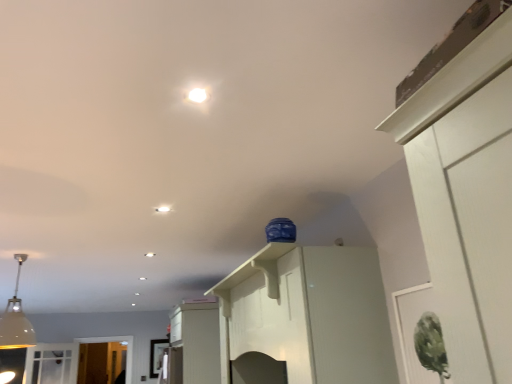
Question: From a real-world perspective, is white glossy cabinet at upper center, which ranks as the 2th cabinetry in bottom-to-top order, located higher than white glossy light fixture at center?

Choices:
 (A) no
 (B) yes

Answer: (A)

Question: Is white glossy cabinet at upper center, which appears as the 1th cabinetry when viewed from the front, to the right of white glossy light fixture at center from the viewer's perspective?

Choices:
 (A) yes
 (B) no

Answer: (A)

Question: Considering the relative sizes of white glossy cabinet at upper center, which is counted as the 1th cabinetry, starting from the top, and white glossy light fixture at center in the image provided, is white glossy cabinet at upper center, which is counted as the 1th cabinetry, starting from the top, taller than white glossy light fixture at center?

Choices:
 (A) no
 (B) yes

Answer: (B)

Question: Is white glossy cabinet at upper center, marked as the 2th cabinetry in a left-to-right arrangement, thinner than white glossy light fixture at center?

Choices:
 (A) yes
 (B) no

Answer: (B)

Question: Is white glossy cabinet at upper center, marked as the 2th cabinetry in a left-to-right arrangement, far away from white glossy light fixture at center?

Choices:
 (A) no
 (B) yes

Answer: (A)

Question: Would you say white glossy cabinet at upper center, the first cabinetry viewed from the right, is outside white glossy light fixture at center?

Choices:
 (A) yes
 (B) no

Answer: (A)

Question: Does white glossy light fixture at center have a larger size compared to white glossy cabinet at upper center, marked as the 2th cabinetry in a left-to-right arrangement?

Choices:
 (A) no
 (B) yes

Answer: (A)

Question: Does white glossy light fixture at center appear on the right side of white glossy cabinet at upper center, which appears as the 1th cabinetry when viewed from the front?

Choices:
 (A) no
 (B) yes

Answer: (A)

Question: From the image's perspective, does white glossy light fixture at center appear lower than white glossy cabinet at upper center, which is counted as the 1th cabinetry, starting from the top?

Choices:
 (A) no
 (B) yes

Answer: (A)

Question: Considering the relative sizes of white glossy light fixture at center and white glossy cabinet at upper center, which ranks as the 2th cabinetry in bottom-to-top order, in the image provided, is white glossy light fixture at center wider than white glossy cabinet at upper center, which ranks as the 2th cabinetry in bottom-to-top order,?

Choices:
 (A) yes
 (B) no

Answer: (B)

Question: From the image's perspective, is white glossy light fixture at center located above white glossy cabinet at upper center, which ranks as the 2th cabinetry in bottom-to-top order?

Choices:
 (A) yes
 (B) no

Answer: (A)

Question: From a real-world perspective, is white glossy light fixture at center under white glossy cabinet at upper center, which is counted as the 1th cabinetry, starting from the top?

Choices:
 (A) no
 (B) yes

Answer: (A)

Question: Does white glossy cabinet at center, the 1th cabinetry ordered from the bottom, have a lesser height compared to white glossy light fixture at center?

Choices:
 (A) yes
 (B) no

Answer: (B)